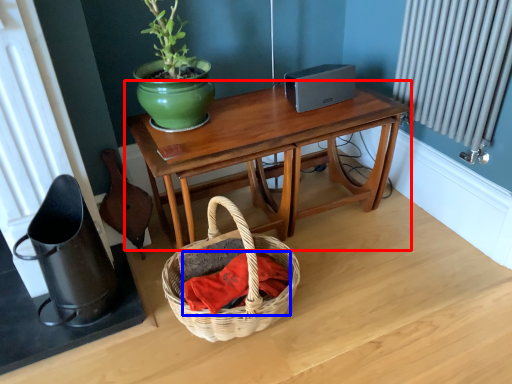
Question: Which object appears closest to the camera in this image, table (highlighted by a red box) or material (highlighted by a blue box)?

Choices:
 (A) table
 (B) material

Answer: (B)